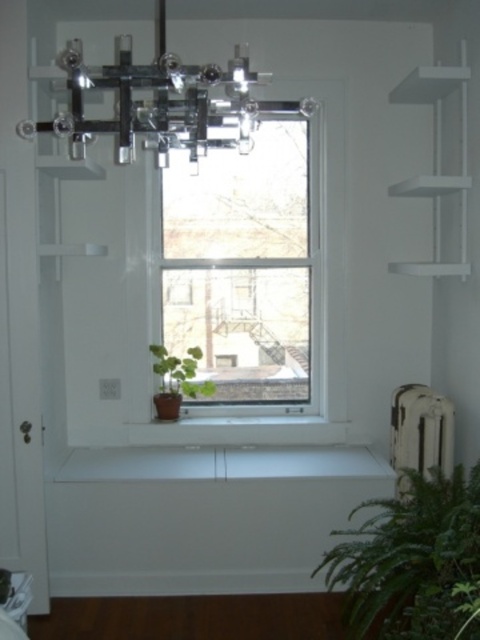
You are an interior designer arranging plants in a room with a window. You have two plants, the green leafy plant at lower right and the green matte plant at lower left. Based on their positions, which plant is closer to the floor?

The green leafy plant at lower right is closer to the floor because it is positioned below the green matte plant at lower left.

You are standing in the room and want to know where the clear glass window at center is located. Please provide its coordinates in the image.

The clear glass window at center is located at coordinates point (244,262).